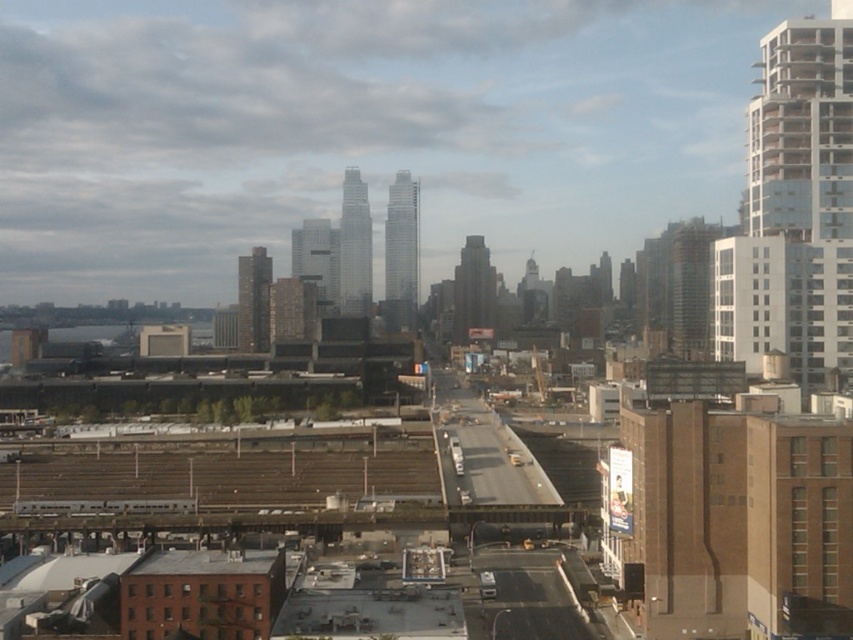
Between point (389, 324) and point (326, 289), which one is positioned behind?

Point (389, 324)

The image size is (853, 640). Find the location of `smooth glass skyscraper at center`. smooth glass skyscraper at center is located at coordinates (401, 253).

Between point (398, 285) and point (338, 244), which one is positioned in front?

Positioned in front is point (398, 285).

You are a GUI agent. You are given a task and a screenshot of the screen. Output one action in this format:
    pyautogui.click(x=<x>, y=<y>)
    Task: Click on the smooth glass skyscraper at center
    
    Given the screenshot: What is the action you would take?
    pyautogui.click(x=401, y=253)

Identify the location of smooth glass skyscraper at center. (401, 253).

Is point (401, 224) in front of point (358, 275)?

No.

Identify the location of smooth glass skyscraper at center. Image resolution: width=853 pixels, height=640 pixels. (401, 253).

Which is more to the right, glassy steel skyscraper at center or dark gray concrete skyscraper at center?

dark gray concrete skyscraper at center

Who is positioned more to the left, glassy steel skyscraper at center or dark gray concrete skyscraper at center?

From the viewer's perspective, glassy steel skyscraper at center appears more on the left side.

Between point (341, 204) and point (463, 339), which one is positioned in front?

Point (463, 339) is more forward.

Where is `glassy steel skyscraper at center`? The image size is (853, 640). glassy steel skyscraper at center is located at coordinates (354, 248).